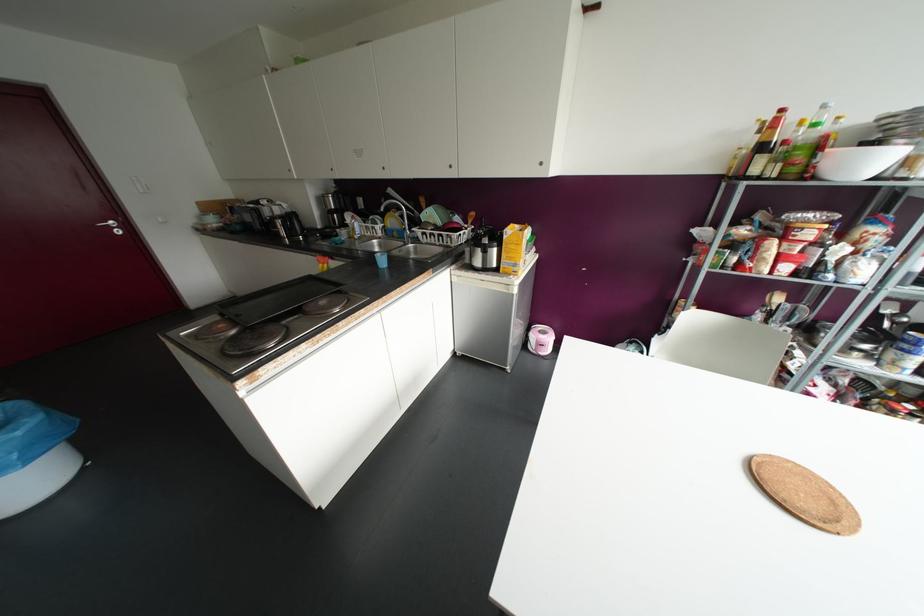
Where is `silver door handle`? silver door handle is located at coordinates (112, 225).